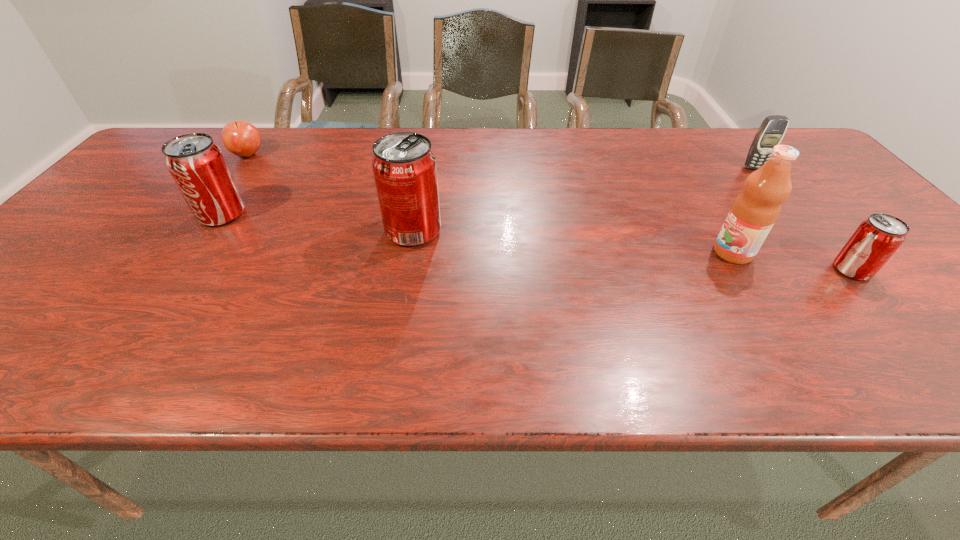
This screenshot has width=960, height=540. What are the coordinates of `free point located 0.100m on the front of the second tallest pop soda` in the screenshot? It's located at (194, 256).

Locate an element on the screen. This screenshot has width=960, height=540. vacant region located 0.400m on the back of the fourth object from right to left is located at coordinates (429, 138).

Where is `free spot located 0.200m on the back of the rightmost pop soda`? free spot located 0.200m on the back of the rightmost pop soda is located at coordinates (797, 206).

Locate an element on the screen. This screenshot has height=540, width=960. free space located on the left of the apple is located at coordinates (151, 154).

I want to click on vacant space situated on the front face of the second farthest object, so click(x=828, y=259).

What are the coordinates of `vacant space positioned on the front label of the fourth object from left to right` in the screenshot? It's located at click(x=648, y=253).

This screenshot has height=540, width=960. Identify the location of vacant space located on the front label of the fourth object from left to right. (636, 253).

Where is `vacant area located on the front label of the fourth object from left to right`? vacant area located on the front label of the fourth object from left to right is located at coordinates (540, 253).

At what (x,y) coordinates should I click in order to perform the action: click on apple that is at the far edge. Please return your answer as a coordinate pair (x, y). Looking at the image, I should click on (241, 138).

The width and height of the screenshot is (960, 540). Find the location of `cellular telephone that is at the far edge`. cellular telephone that is at the far edge is located at coordinates (772, 130).